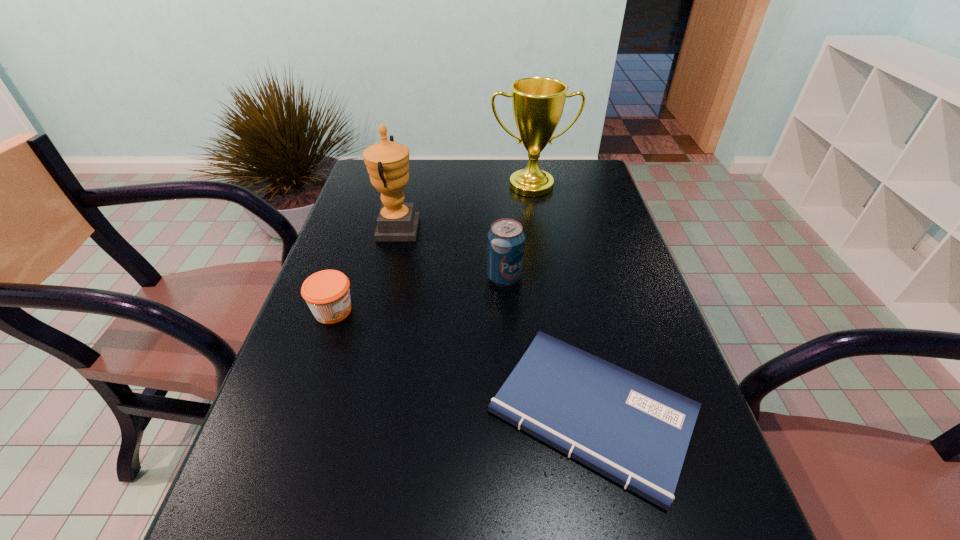
Locate an element on the screen. The width and height of the screenshot is (960, 540). object positioned at the far right corner is located at coordinates (537, 102).

The image size is (960, 540). Identify the location of vacant space at the far edge of the desktop. (462, 160).

The height and width of the screenshot is (540, 960). I want to click on vacant space at the left edge of the desktop, so click(249, 489).

The image size is (960, 540). In order to click on vacant space at the right edge of the desktop in this screenshot , I will do `click(581, 212)`.

Locate an element on the screen. The width and height of the screenshot is (960, 540). vacant region at the far right corner of the desktop is located at coordinates (596, 163).

This screenshot has width=960, height=540. Find the location of `vacant area between the farthest object and the nearest object`. vacant area between the farthest object and the nearest object is located at coordinates click(562, 299).

Find the location of a particular element. free space between the left award and the nearest object is located at coordinates (494, 321).

Image resolution: width=960 pixels, height=540 pixels. I want to click on vacant area that lies between the shortest object and the jam, so click(x=463, y=362).

Where is `vacant space in between the fourth farthest object and the farthest object`? The width and height of the screenshot is (960, 540). vacant space in between the fourth farthest object and the farthest object is located at coordinates (432, 248).

Identify the location of free space that is in between the nearer award and the right award. (464, 208).